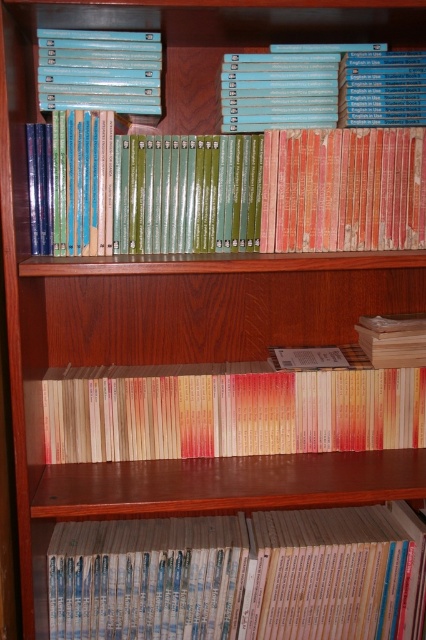
From the picture: Is green matte book at center further to the viewer compared to blue hardcover books at upper center?

No, it is not.

Can you confirm if green matte book at center is smaller than blue hardcover books at upper center?

Actually, green matte book at center might be larger than blue hardcover books at upper center.

Locate an element on the screen. This screenshot has width=426, height=640. green matte book at center is located at coordinates (230, 189).

Is green matte book at center closer to camera compared to beige paper book at center?

Yes, green matte book at center is in front of beige paper book at center.

Who is more forward, (x=307, y=246) or (x=71, y=396)?

Point (x=307, y=246) is in front.

This screenshot has width=426, height=640. I want to click on green matte book at center, so click(x=230, y=189).

Who is positioned more to the right, light beige paperbacks at lower center or beige paper book at center?

beige paper book at center is more to the right.

Which is below, light beige paperbacks at lower center or beige paper book at center?

light beige paperbacks at lower center is below.

Who is more forward, (91, 593) or (265, 440)?

Point (91, 593) is in front.

Find the location of a particular element. This screenshot has width=426, height=640. light beige paperbacks at lower center is located at coordinates (241, 576).